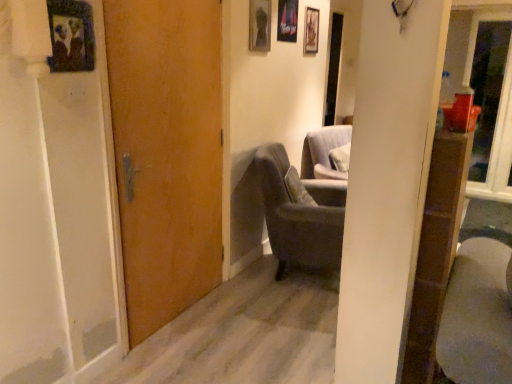
Question: Relative to dark gray fabric chair at center, is wooden door at center in front or behind?

Choices:
 (A) front
 (B) behind

Answer: (A)

Question: From the image's perspective, is wooden door at center above or below dark gray fabric chair at center?

Choices:
 (A) above
 (B) below

Answer: (A)

Question: Which of these objects is positioned closest to the wooden door at center?

Choices:
 (A) metallic silver picture frame at upper center, marked as the second picture frame in a right-to-left arrangement
 (B) transparent glass door at upper right
 (C) wooden picture frame at upper left, which is the 4th picture frame from back to front
 (D) matte glass picture frame at upper center, which ranks as the third picture frame in right-to-left order
 (E) dark gray fabric chair at center

Answer: (C)

Question: Which of these objects is positioned farthest from the dark gray fabric chair at center?

Choices:
 (A) metallic silver picture frame at upper center, which ranks as the third picture frame in left-to-right order
 (B) transparent glass door at upper right
 (C) wooden picture frame at upper left, which is the 4th picture frame from back to front
 (D) wooden picture frame at upper center, which is the fourth picture frame from left to right
 (E) wooden door at center

Answer: (B)